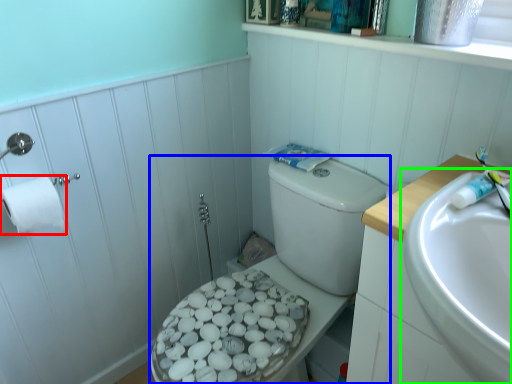
Question: Considering the real-world distances, which object is closest to toilet paper (highlighted by a red box)? porcelain (highlighted by a blue box) or sink (highlighted by a green box).

Choices:
 (A) porcelain
 (B) sink

Answer: (A)